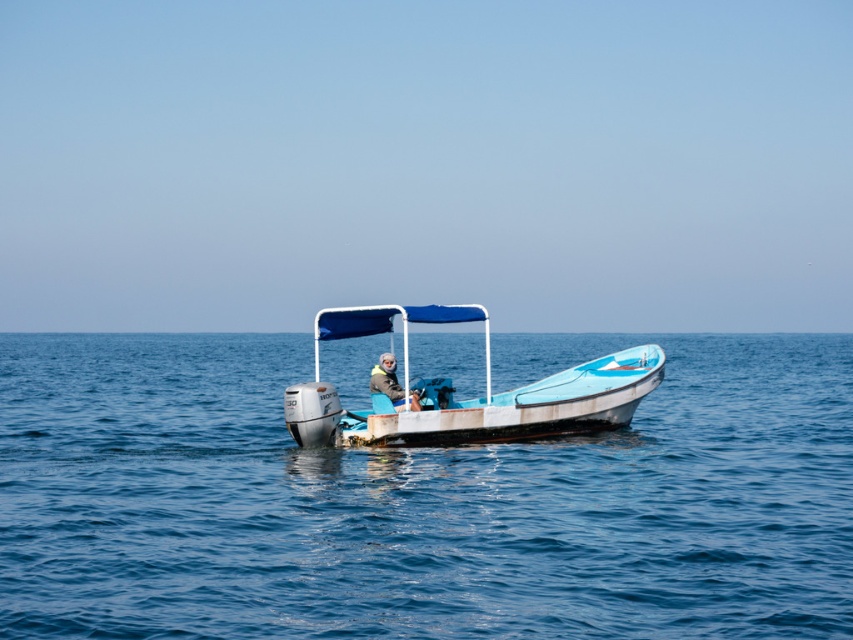
Question: Estimate the real-world distances between objects in this image. Which object is closer to the blue water at center?

Choices:
 (A) light blue plastic boat at center
 (B) gray knit hat at center

Answer: (B)

Question: Among these objects, which one is farthest from the camera?

Choices:
 (A) gray knit hat at center
 (B) blue water at center
 (C) light blue plastic boat at center

Answer: (A)

Question: Which point is farther to the camera?

Choices:
 (A) light blue plastic boat at center
 (B) blue water at center

Answer: (A)

Question: Does blue water at center appear on the right side of light blue plastic boat at center?

Choices:
 (A) no
 (B) yes

Answer: (A)

Question: Is blue water at center positioned before gray knit hat at center?

Choices:
 (A) yes
 (B) no

Answer: (A)

Question: Is blue water at center wider than gray knit hat at center?

Choices:
 (A) no
 (B) yes

Answer: (B)